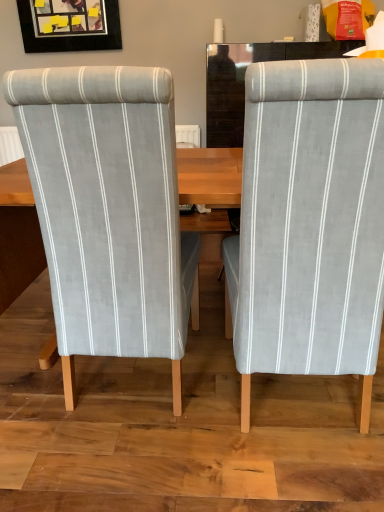
Identify the location of vacant area that is in front of light gray fabric chair at left, the 2th chair positioned from the right. This screenshot has height=512, width=384. (132, 462).